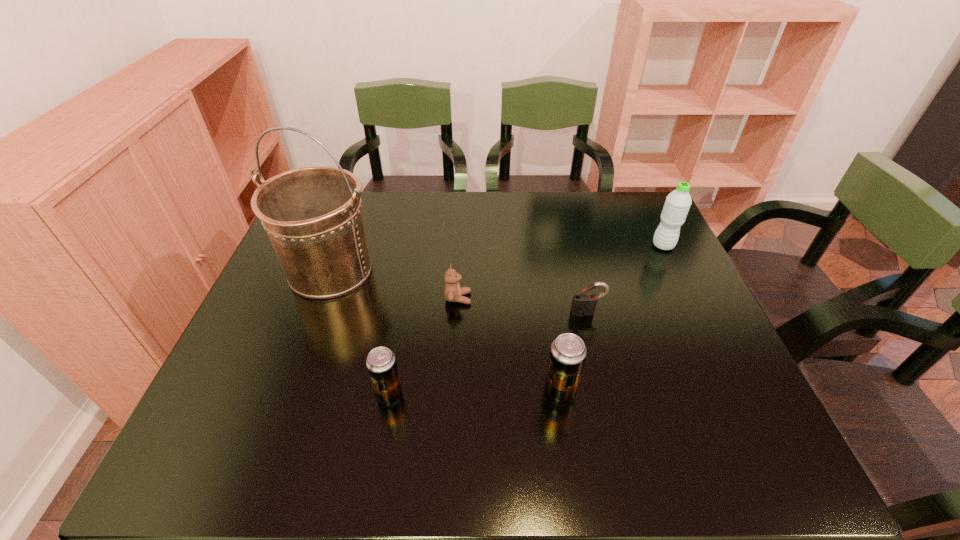
Where is `vacant area situated on the right of the fifth object from right to left`? Image resolution: width=960 pixels, height=540 pixels. vacant area situated on the right of the fifth object from right to left is located at coordinates (549, 396).

Where is `free space located 0.130m on the right of the taller beer can`? free space located 0.130m on the right of the taller beer can is located at coordinates (636, 393).

Where is `vacant space located 0.190m on the back of the water bottle`? The image size is (960, 540). vacant space located 0.190m on the back of the water bottle is located at coordinates (643, 203).

The height and width of the screenshot is (540, 960). In order to click on free region located with the keyhole on the front of the padlock in this screenshot , I will do `click(601, 369)`.

Locate an element on the screen. The height and width of the screenshot is (540, 960). vacant space situated 0.250m on the front-facing side of the teddy bear is located at coordinates (567, 298).

You are a GUI agent. You are given a task and a screenshot of the screen. Output one action in this format:
    pyautogui.click(x=<x>, y=<y>)
    Task: Click on the blank area located 0.060m on the right of the bucket
    The width and height of the screenshot is (960, 540).
    Given the screenshot: What is the action you would take?
    click(x=403, y=271)

The image size is (960, 540). I want to click on object situated at the left edge, so click(x=313, y=216).

The width and height of the screenshot is (960, 540). Identify the location of object situated at the right edge. (677, 204).

This screenshot has width=960, height=540. Identify the location of free location at the far edge. (454, 218).

Identify the location of vacant region at the near edge. (673, 399).